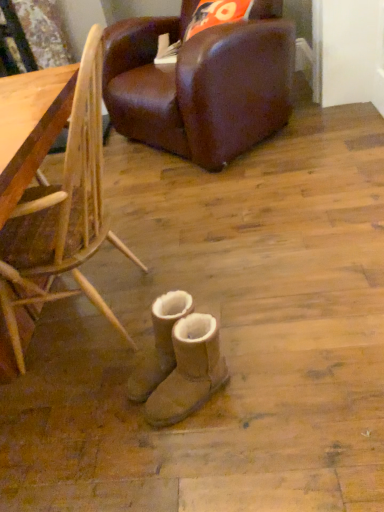
Question: Considering the relative sizes of tan suede boots at center, the 2th footwear positioned from the front, and bamboo chair at lower right, which is the 1th chair in front-to-back order, in the image provided, is tan suede boots at center, the 2th footwear positioned from the front, wider than bamboo chair at lower right, which is the 1th chair in front-to-back order,?

Choices:
 (A) yes
 (B) no

Answer: (B)

Question: Are tan suede boots at center, the 2th footwear positioned from the front, and bamboo chair at lower right, which is the 1th chair in front-to-back order, far apart?

Choices:
 (A) no
 (B) yes

Answer: (A)

Question: From the image's perspective, is tan suede boots at center, the 2th footwear positioned from the front, over bamboo chair at lower right, positioned as the 2th chair in top-to-bottom order?

Choices:
 (A) no
 (B) yes

Answer: (A)

Question: From a real-world perspective, is tan suede boots at center, which appears as the first footwear when viewed from the back, on bamboo chair at lower right, which is the 1th chair in front-to-back order?

Choices:
 (A) yes
 (B) no

Answer: (B)

Question: Is tan suede boots at center, which appears as the first footwear when viewed from the back, to the right of bamboo chair at lower right, which is the first chair in bottom-to-top order, from the viewer's perspective?

Choices:
 (A) yes
 (B) no

Answer: (A)

Question: Does tan suede boots at center, the 2th footwear positioned from the front, have a greater height compared to bamboo chair at lower right, positioned as the 2th chair in top-to-bottom order?

Choices:
 (A) yes
 (B) no

Answer: (B)

Question: Can you confirm if bamboo chair at lower right, positioned as the 2th chair in top-to-bottom order, is positioned to the left of tan suede boots at center, which appears as the first footwear when viewed from the back?

Choices:
 (A) no
 (B) yes

Answer: (B)

Question: Considering the relative positions of bamboo chair at lower right, marked as the second chair in a back-to-front arrangement, and tan suede boots at center, which appears as the first footwear when viewed from the back, in the image provided, is bamboo chair at lower right, marked as the second chair in a back-to-front arrangement, to the right of tan suede boots at center, which appears as the first footwear when viewed from the back, from the viewer's perspective?

Choices:
 (A) no
 (B) yes

Answer: (A)

Question: Would you say bamboo chair at lower right, marked as the second chair in a back-to-front arrangement, contains tan suede boots at center, the 2th footwear positioned from the front?

Choices:
 (A) yes
 (B) no

Answer: (B)

Question: From a real-world perspective, does bamboo chair at lower right, which is the 1th chair in front-to-back order, sit lower than tan suede boots at center, the 2th footwear positioned from the front?

Choices:
 (A) yes
 (B) no

Answer: (B)

Question: Considering the relative sizes of bamboo chair at lower right, which is the first chair in bottom-to-top order, and tan suede boots at center, the 2th footwear positioned from the front, in the image provided, is bamboo chair at lower right, which is the first chair in bottom-to-top order, wider than tan suede boots at center, the 2th footwear positioned from the front,?

Choices:
 (A) no
 (B) yes

Answer: (B)

Question: From a real-world perspective, is bamboo chair at lower right, which is the first chair in bottom-to-top order, positioned over tan suede boots at center, the 2th footwear positioned from the front, based on gravity?

Choices:
 (A) yes
 (B) no

Answer: (A)

Question: Can we say tan suede boots at center, positioned as the first footwear in front-to-back order, lies outside tan suede boots at center, which appears as the first footwear when viewed from the back?

Choices:
 (A) yes
 (B) no

Answer: (A)